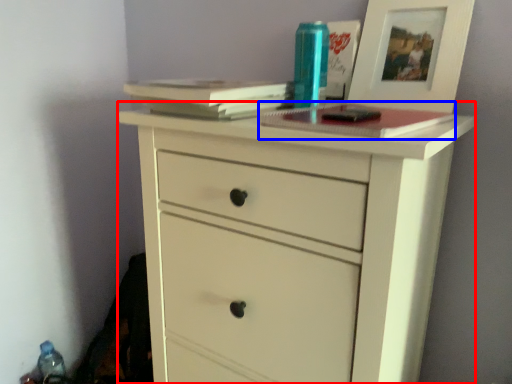
Question: Which object is further to the camera taking this photo, chest of drawers (highlighted by a red box) or paperback book (highlighted by a blue box)?

Choices:
 (A) chest of drawers
 (B) paperback book

Answer: (B)